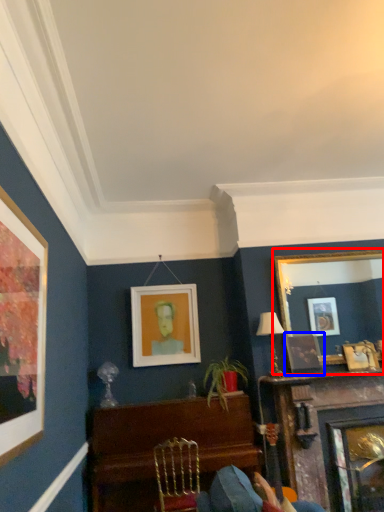
Question: Which object is further to the camera taking this photo, picture frame (highlighted by a red box) or picture frame (highlighted by a blue box)?

Choices:
 (A) picture frame
 (B) picture frame

Answer: (A)